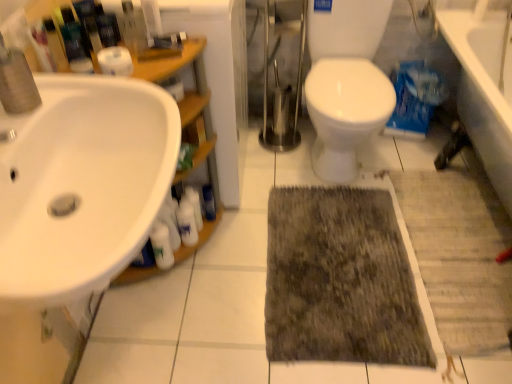
Question: From a real-world perspective, is white glossy bottle at center, which is the 1th toiletry in right-to-left order, physically located above or below white glossy sink at left?

Choices:
 (A) below
 (B) above

Answer: (A)

Question: In terms of size, does white glossy bottle at center, positioned as the 2th toiletry in left-to-right order, appear bigger or smaller than white glossy sink at left?

Choices:
 (A) small
 (B) big

Answer: (A)

Question: Which is nearer to the white glossy sink at left?

Choices:
 (A) white glossy bottle at center, which is the 1th toiletry in right-to-left order
 (B) dark gray shaggy rug at center
 (C) white glossy bottle at lower left, which appears as the second cleaning product when viewed from the left
 (D) white glossy bottle at lower left, positioned as the 1th toiletry in left-to-right order
 (E) white glossy bottle at lower left, which is the first cleaning product from left to right

Answer: (E)

Question: Considering the real-world distances, which object is closest to the dark gray shaggy rug at center?

Choices:
 (A) white glossy bottle at lower left, marked as the second toiletry in a right-to-left arrangement
 (B) white glossy bottle at lower left, marked as the second cleaning product in a right-to-left arrangement
 (C) white glossy bottle at center, which is the 1th toiletry in right-to-left order
 (D) white glossy bottle at lower left, acting as the 1th cleaning product starting from the right
 (E) white glossy sink at left

Answer: (D)